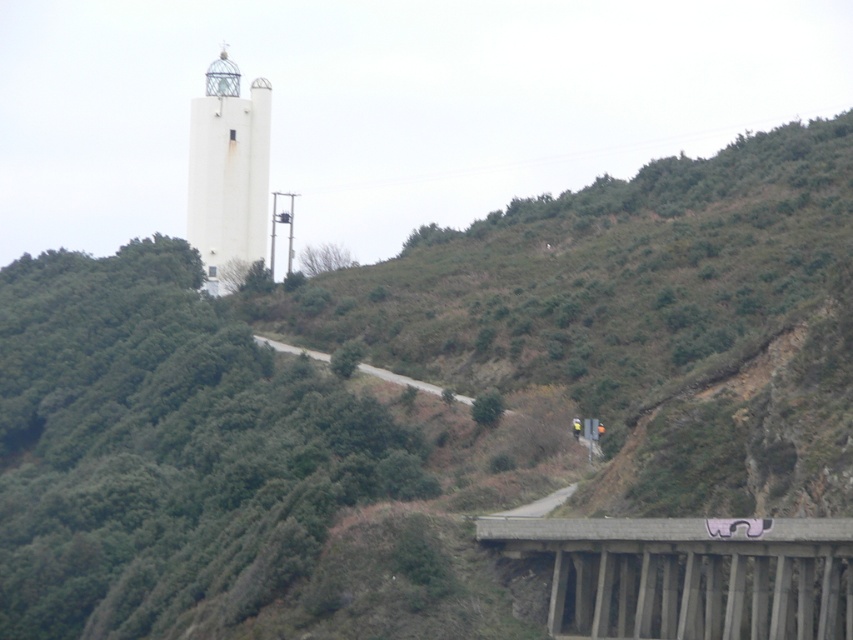
Question: Which point appears farthest from the camera in this image?

Choices:
 (A) (212, 179)
 (B) (817, 616)

Answer: (A)

Question: Is concrete at lower right in front of white matte/lightweight bell tower at upper center?

Choices:
 (A) no
 (B) yes

Answer: (B)

Question: Can you confirm if concrete at lower right is wider than white matte/lightweight bell tower at upper center?

Choices:
 (A) no
 (B) yes

Answer: (A)

Question: Where is concrete at lower right located in relation to white matte/lightweight bell tower at upper center in the image?

Choices:
 (A) right
 (B) left

Answer: (A)

Question: Which of the following is the closest to the observer?

Choices:
 (A) white matte/lightweight bell tower at upper center
 (B) concrete at lower right

Answer: (B)